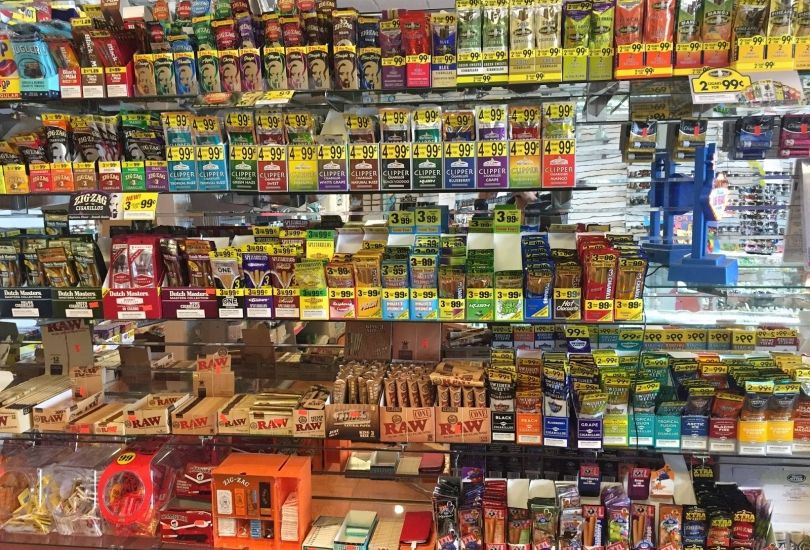
The height and width of the screenshot is (550, 810). I want to click on glass shelves, so click(675, 320), click(642, 451), click(509, 192).